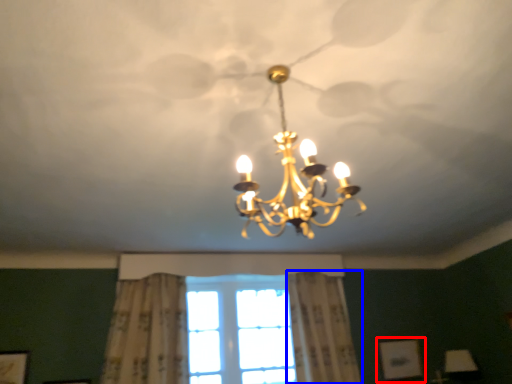
Question: Which of the following is the farthest to the observer, picture frame (highlighted by a red box) or curtain (highlighted by a blue box)?

Choices:
 (A) picture frame
 (B) curtain

Answer: (A)